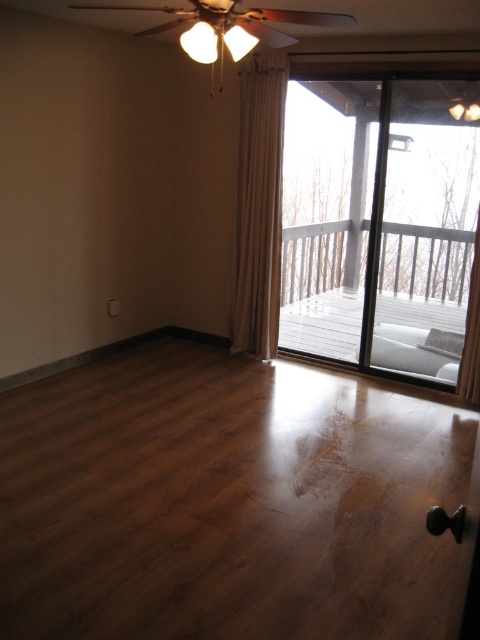
Question: Which of the following is the closest to the observer?

Choices:
 (A) (340, 298)
 (B) (235, 278)
 (C) (237, 436)
 (D) (468, 381)

Answer: (C)

Question: Can you confirm if wooden deck at center is positioned to the left of white sheer curtain at right?

Choices:
 (A) yes
 (B) no

Answer: (A)

Question: Is wooden deck at center closer to camera compared to white sheer curtain at right?

Choices:
 (A) no
 (B) yes

Answer: (B)

Question: Does wooden deck at center have a greater width compared to white sheer curtain at right?

Choices:
 (A) yes
 (B) no

Answer: (A)

Question: Which of the following is the closest to the observer?

Choices:
 (A) wooden deck at center
 (B) transparent glass door at center
 (C) beige fabric curtain at center

Answer: (A)

Question: Which object appears closest to the camera in this image?

Choices:
 (A) white sheer curtain at right
 (B) transparent glass door at center

Answer: (B)